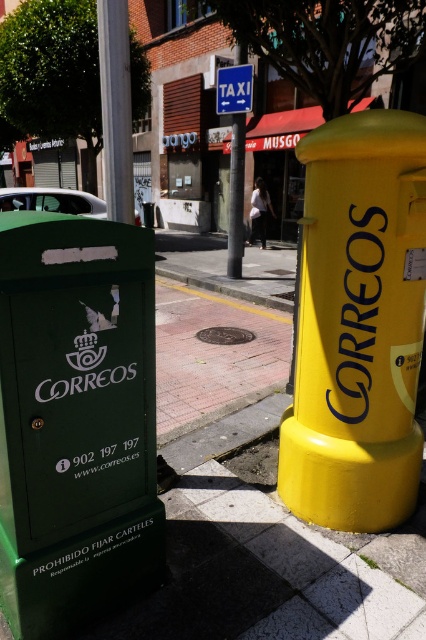
Question: Can you confirm if smooth white post at center is smaller than matte white car at upper left?

Choices:
 (A) no
 (B) yes

Answer: (B)

Question: Which point is farther to the camera?

Choices:
 (A) (17, 476)
 (B) (104, 16)

Answer: (B)

Question: Can you confirm if smooth white post at center is positioned to the left of blue plastic taxi sign at upper center?

Choices:
 (A) no
 (B) yes

Answer: (B)

Question: Which point is farther to the camera?

Choices:
 (A) blue plastic taxi sign at upper center
 (B) matte white car at upper left

Answer: (B)

Question: Does smooth white post at center appear on the left side of blue plastic taxi sign at upper center?

Choices:
 (A) yes
 (B) no

Answer: (A)

Question: Among these points, which one is nearest to the camera?

Choices:
 (A) (219, 93)
 (B) (100, 477)
 (C) (54, 205)

Answer: (B)